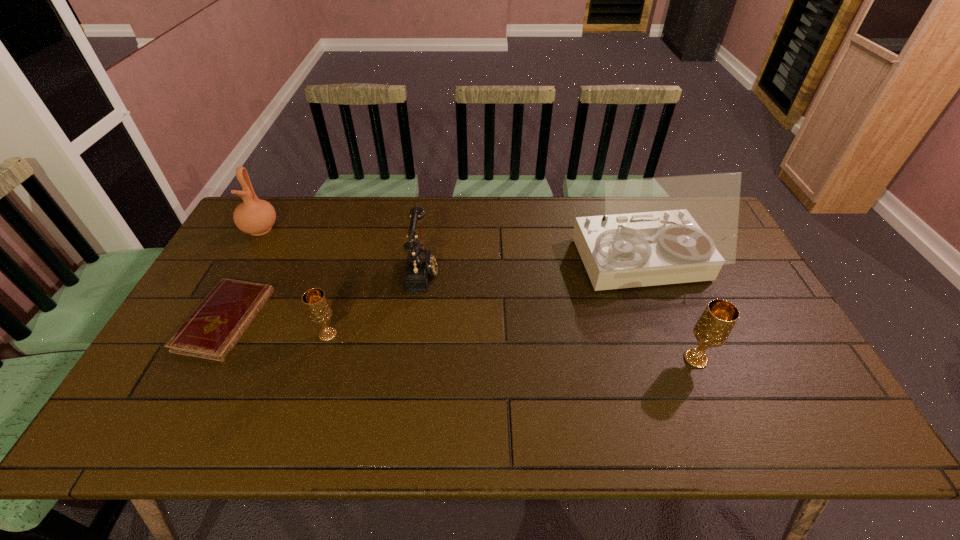
You are a GUI agent. You are given a task and a screenshot of the screen. Output one action in this format:
    pyautogui.click(x=<x>, y=<y>)
    Task: Click on the free space located 0.220m on the spout of the pottery
    
    Given the screenshot: What is the action you would take?
    pyautogui.click(x=227, y=290)

Locate an element on the screen. Image resolution: width=960 pixels, height=540 pixels. vacant region located on the dial of the third object from right to left is located at coordinates (494, 271).

This screenshot has width=960, height=540. In order to click on free spot located on the front of the tallest object in this screenshot , I will do `click(664, 325)`.

Where is `free space located on the back of the shortest object`? free space located on the back of the shortest object is located at coordinates (253, 266).

In order to click on pottery at the far edge in this screenshot , I will do `click(254, 216)`.

Locate an element on the screen. record player present at the far edge is located at coordinates (665, 230).

Where is `object located at the near edge`? object located at the near edge is located at coordinates (712, 329).

Image resolution: width=960 pixels, height=540 pixels. Identify the location of pottery that is at the left edge. (254, 216).

The height and width of the screenshot is (540, 960). I want to click on notebook that is at the left edge, so click(213, 329).

Find the location of a particular element. The width and height of the screenshot is (960, 540). object located in the right edge section of the desktop is located at coordinates (665, 230).